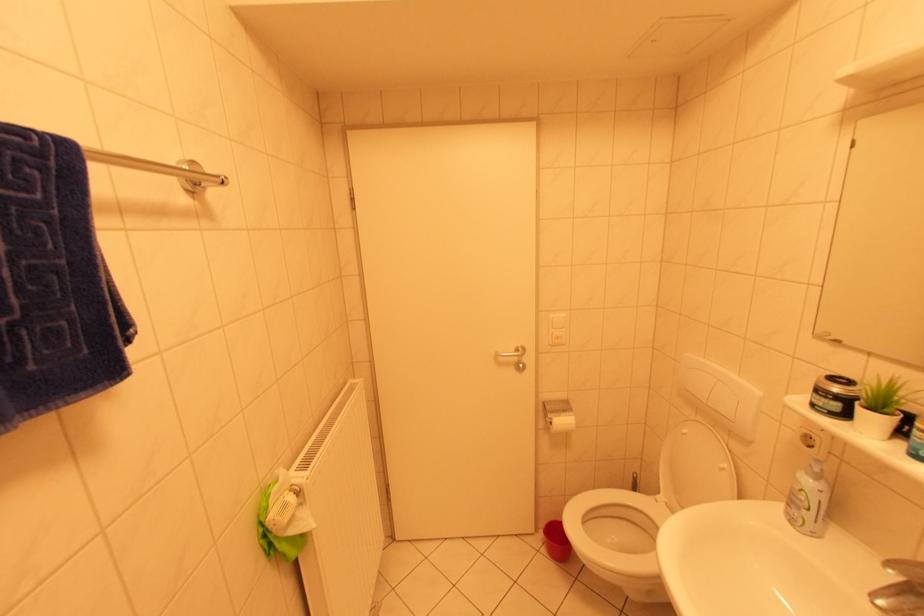
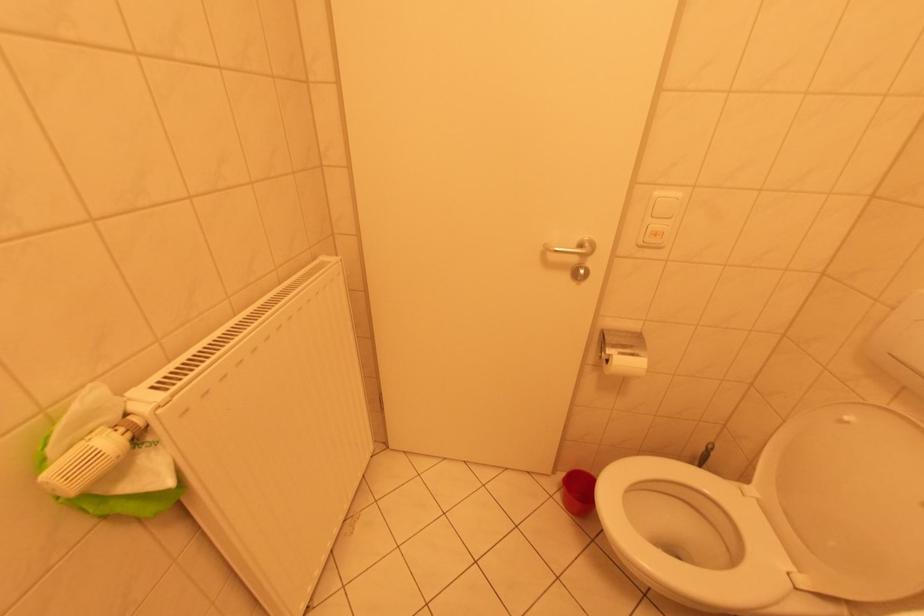
Question: Based on the continuous images, in which direction is the camera rotating? Reply with the corresponding letter.

Choices:
 (A) Left
 (B) Right
 (C) Up
 (D) Down

Answer: (D)